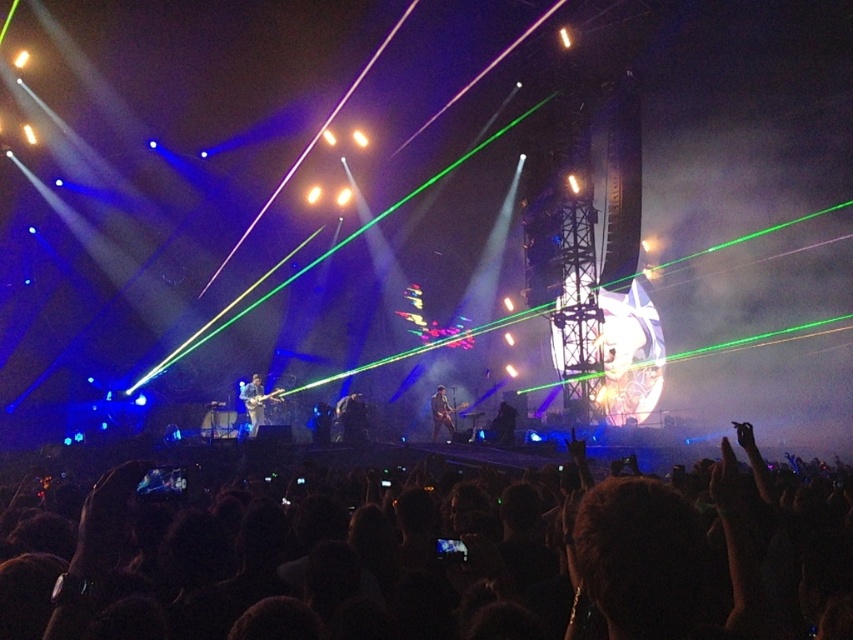
Between point (372, 540) and point (350, 410), which one is positioned behind?

Point (350, 410)

Can you confirm if black hair at lower center is thinner than black leather guitar at center?

In fact, black hair at lower center might be wider than black leather guitar at center.

Is point (767, 589) closer to viewer compared to point (340, 438)?

That is True.

Find the location of a particular element. Image resolution: width=853 pixels, height=640 pixels. black hair at lower center is located at coordinates (451, 563).

Which is in front, point (262, 397) or point (498, 404)?

Positioned in front is point (498, 404).

Is shiny silver guitar at center smaller than black fabric at center?

No.

The image size is (853, 640). I want to click on shiny silver guitar at center, so click(x=256, y=403).

Can you confirm if black hair at lower center is taller than black fabric at center?

Indeed, black hair at lower center has a greater height compared to black fabric at center.

Identify the location of black hair at lower center. (451, 563).

Between point (183, 602) and point (503, 444), which one is positioned in front?

Point (183, 602)

Locate an element on the screen. black hair at lower center is located at coordinates (451, 563).